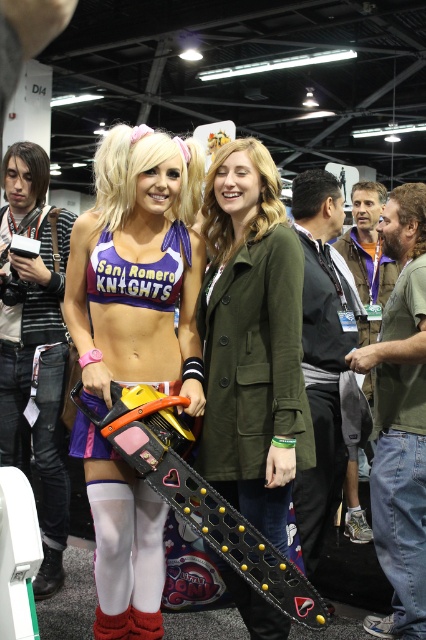
You are a photographer at this event and need to capture a closeup shot of both the green matte jacket at center and the purple fabric bikini top at center. The camera you are using has a maximum focus range of 12 inches. Can you fit both items in the frame without moving the camera?

The green matte jacket at center and the purple fabric bikini top at center are 11.29 inches apart, which is within the camera maximum focus range of 12 inches. Therefore, you can fit both items in the frame without moving the camera.

You are organizing a cosplay photoshoot and need to decide where to place the green matte jacket at center and the purple fabric bikini top at center. Based on their thickness, which item should be placed in a position that requires less space?

The green matte jacket at center is thinner than the purple fabric bikini top at center, so it should be placed in the position that requires less space.

You are a photographer at the event and need to capture both the purple matte sports bra at center and the green matte jacket at center in a single frame. Which object should you focus on first to ensure both are in the frame?

The purple matte sports bra at center is taller than the green matte jacket at center, so focusing on the purple matte sports bra at center first will help ensure both are in the frame.